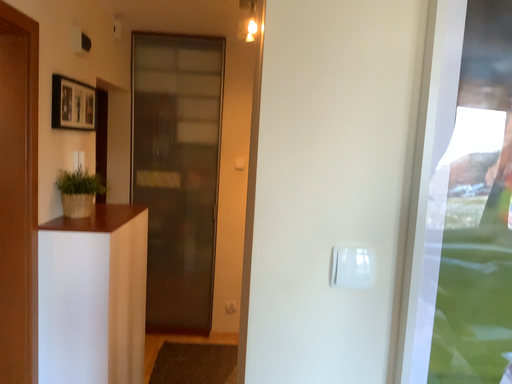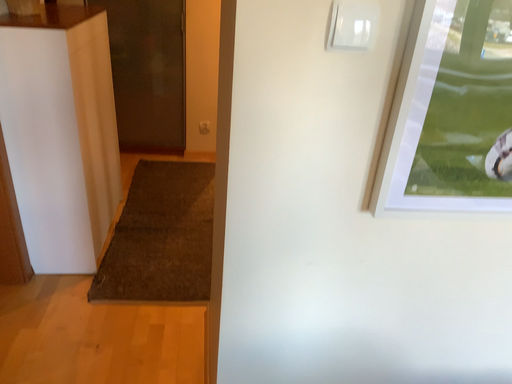
Question: Which way did the camera rotate in the video?

Choices:
 (A) rotated upward
 (B) rotated downward

Answer: (B)